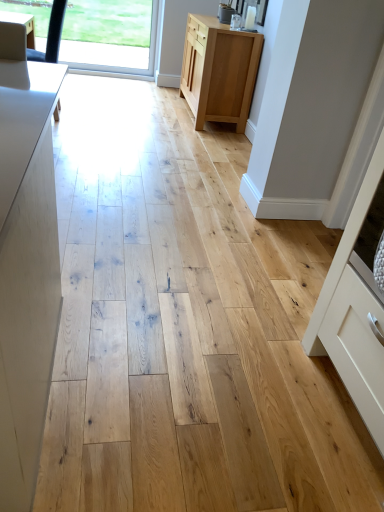
This screenshot has width=384, height=512. Identify the location of vacant space situated on the left part of white matte cabinet at right, the 2th cabinetry when ordered from top to bottom. (251, 391).